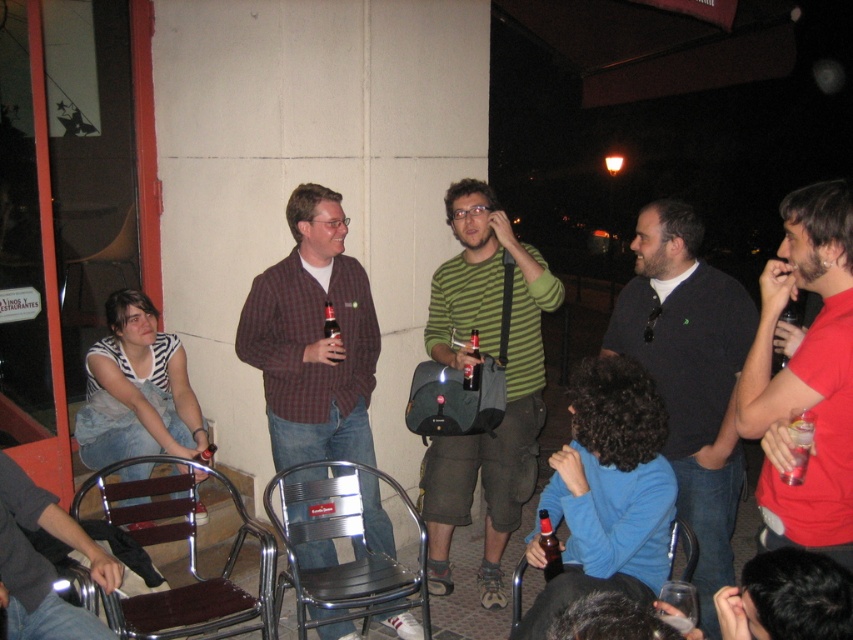
You are standing at the origin point of the coordinate system in the image. You want to move towards the dark gray sweater at center. What direction should you move in?

Since the dark gray sweater at center is located at point (689,376), you should move towards the right and upward direction to reach it.

You are a photographer trying to capture a candid shot of the dark gray sweater at center and the matte glass bottle at center. Since you want to ensure both are in focus, you need to know their relative heights. Which object is taller?

The dark gray sweater at center is much taller than the matte glass bottle at center, so you should adjust your camera settings to account for the height difference to ensure both are in focus.